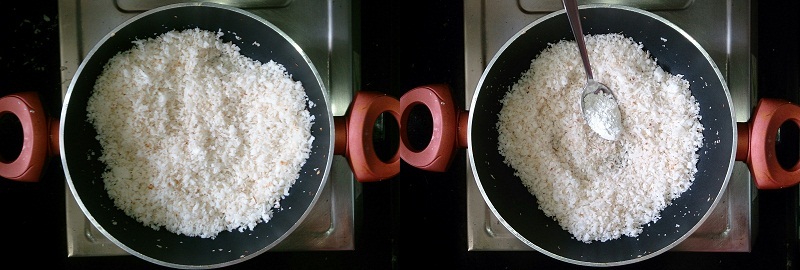
Locate an element on the screen. This screenshot has height=270, width=800. pot is located at coordinates (74, 154), (473, 136).